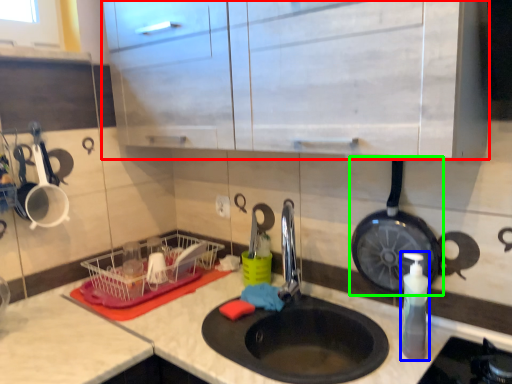
Question: Which is nearer to the cabinetry (highlighted by a red box)? soap dispenser (highlighted by a blue box) or frying pan (highlighted by a green box).

Choices:
 (A) soap dispenser
 (B) frying pan

Answer: (B)